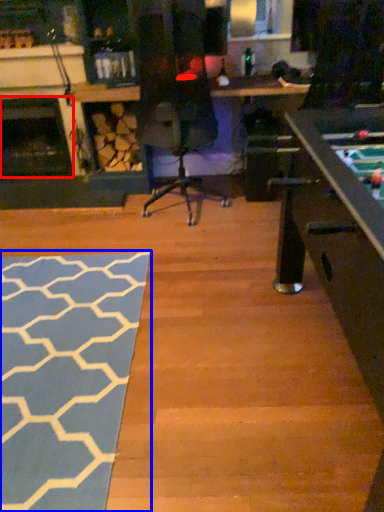
Question: Which of the following is the closest to the observer, fireplace (highlighted by a red box) or mat (highlighted by a blue box)?

Choices:
 (A) fireplace
 (B) mat

Answer: (B)